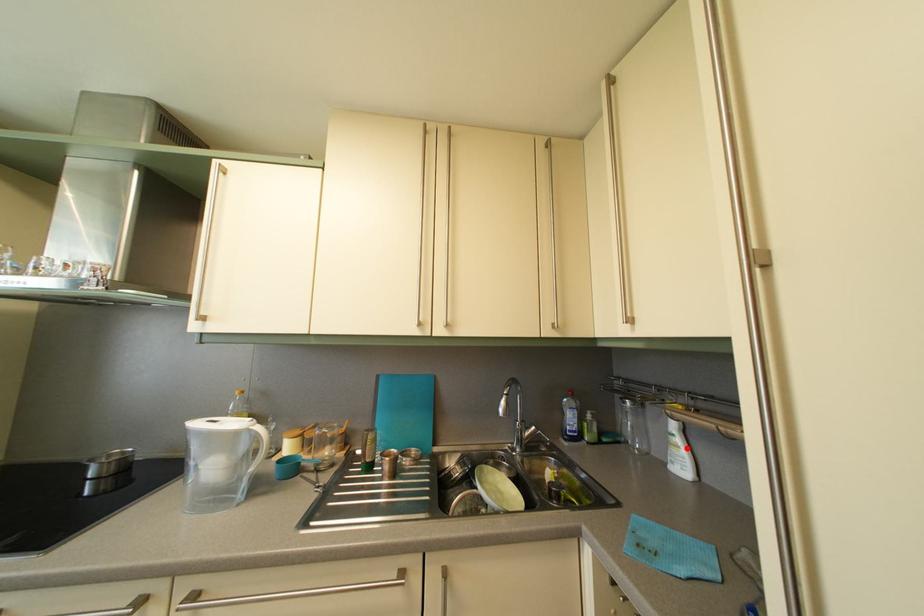
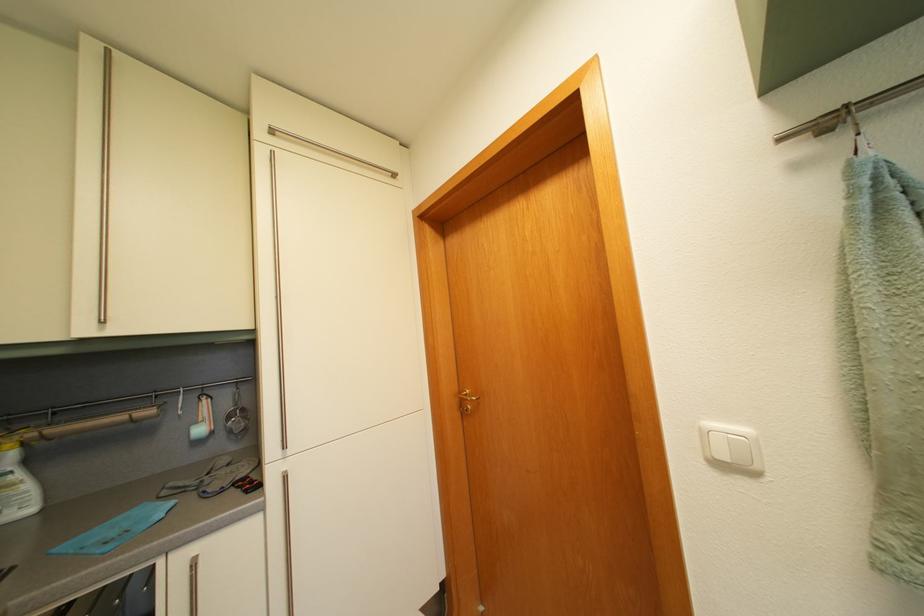
In the second image, find the point that corresponds to the highlighted location in the first image.

(26, 484)